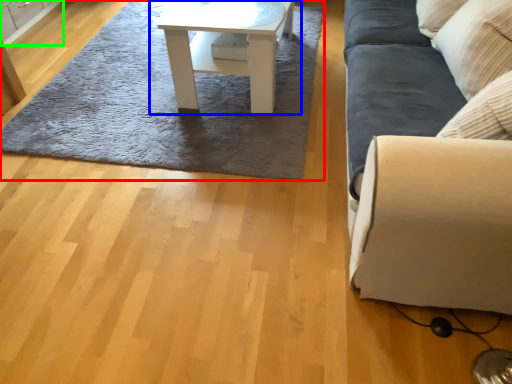
Question: Based on their relative distances, which object is nearer to mat (highlighted by a red box)? Choose from table (highlighted by a blue box) and cabinetry (highlighted by a green box).

Choices:
 (A) table
 (B) cabinetry

Answer: (A)